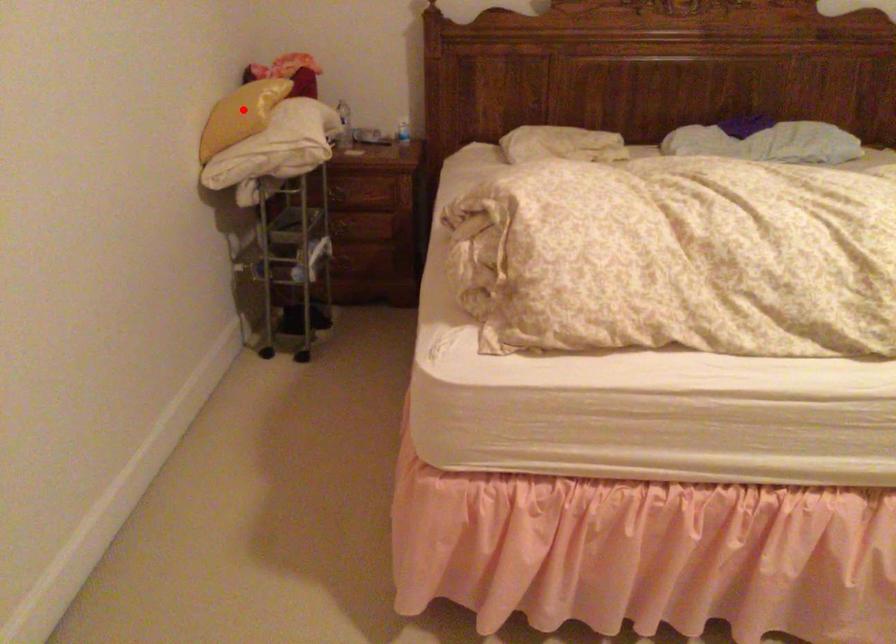
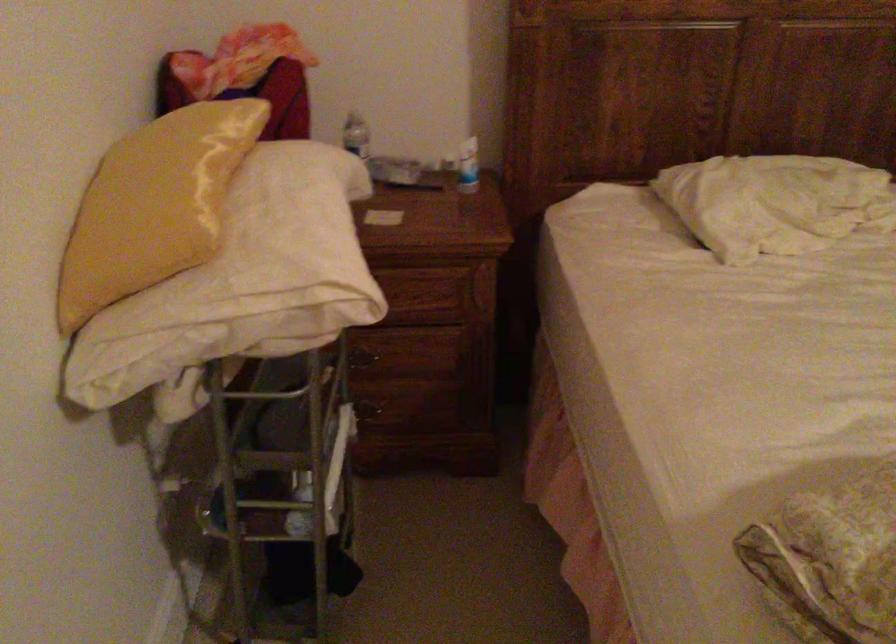
Where in the second image is the point corresponding to the highlighted location from the first image?

(153, 205)